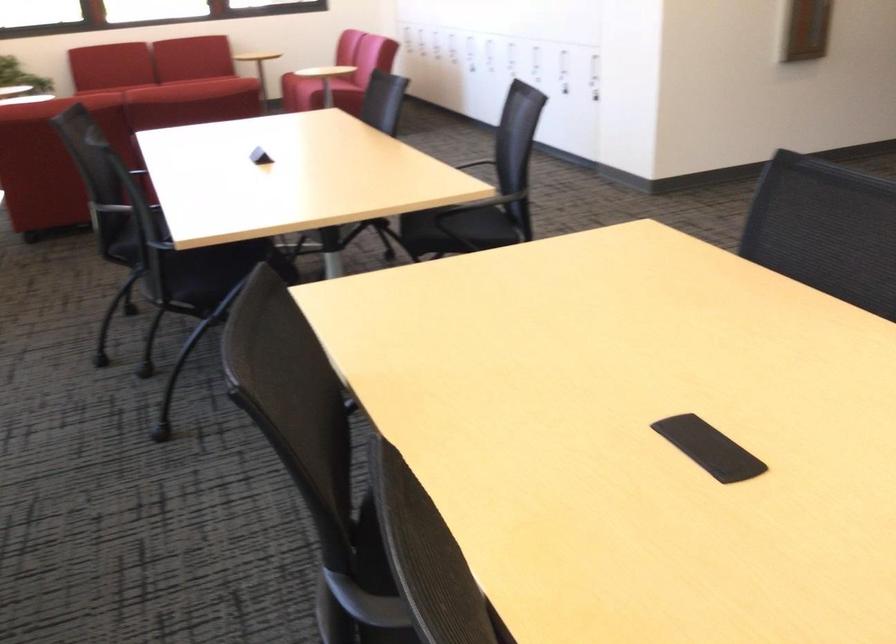
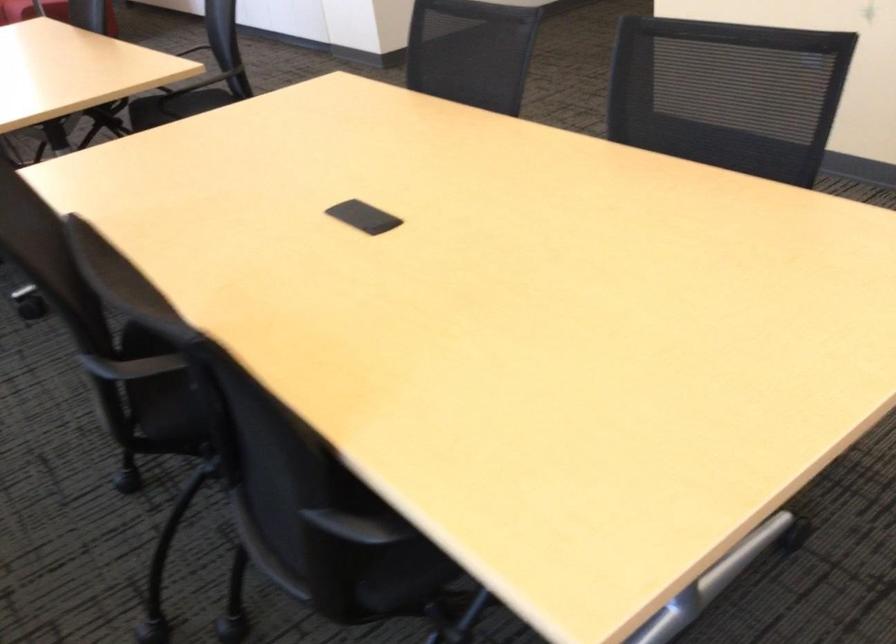
Which direction would the cameraman need to move to produce the second image?

The cameraman moved toward right, backward.